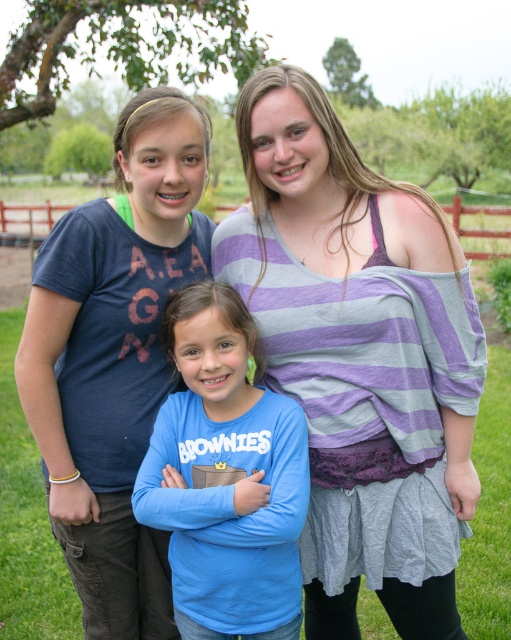
Question: Can you confirm if striped fabric top at center is positioned above blue cotton shirt at center?

Choices:
 (A) no
 (B) yes

Answer: (B)

Question: Which point is farther to the camera?

Choices:
 (A) (303, 544)
 (B) (223, 289)

Answer: (A)

Question: Is striped fabric top at center in front of blue cotton shirt at center?

Choices:
 (A) yes
 (B) no

Answer: (B)

Question: Is striped fabric top at center closer to camera compared to blue cotton shirt at center?

Choices:
 (A) no
 (B) yes

Answer: (A)

Question: Among these points, which one is farthest from the camera?

Choices:
 (A) (382, 570)
 (B) (252, 576)

Answer: (A)